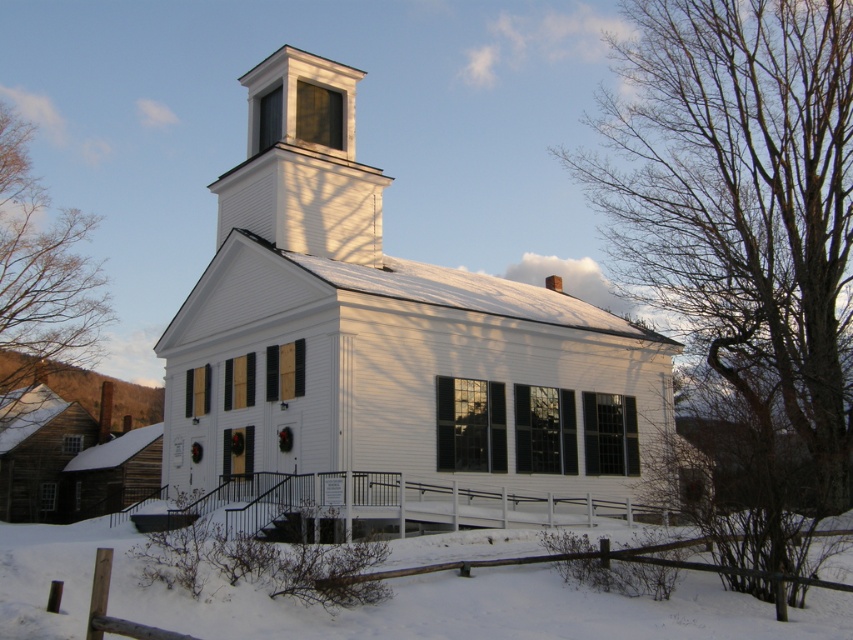
Question: Among these objects, which one is farthest from the camera?

Choices:
 (A) bare branches at right
 (B) white matte church at center
 (C) white powdery snow at lower center

Answer: (B)

Question: Observing the image, what is the correct spatial positioning of bare branches at right in reference to white powdery snow at lower center?

Choices:
 (A) left
 (B) right

Answer: (B)

Question: Observing the image, what is the correct spatial positioning of white matte church at center in reference to white powdery snow at lower center?

Choices:
 (A) above
 (B) below

Answer: (A)

Question: In this image, where is bare branches at right located relative to white powdery snow at lower center?

Choices:
 (A) below
 (B) above

Answer: (B)

Question: Which of the following is the farthest from the observer?

Choices:
 (A) brown leafless tree at left
 (B) white matte church at center

Answer: (A)

Question: Among these points, which one is farthest from the camera?

Choices:
 (A) (0, 333)
 (B) (457, 538)

Answer: (A)